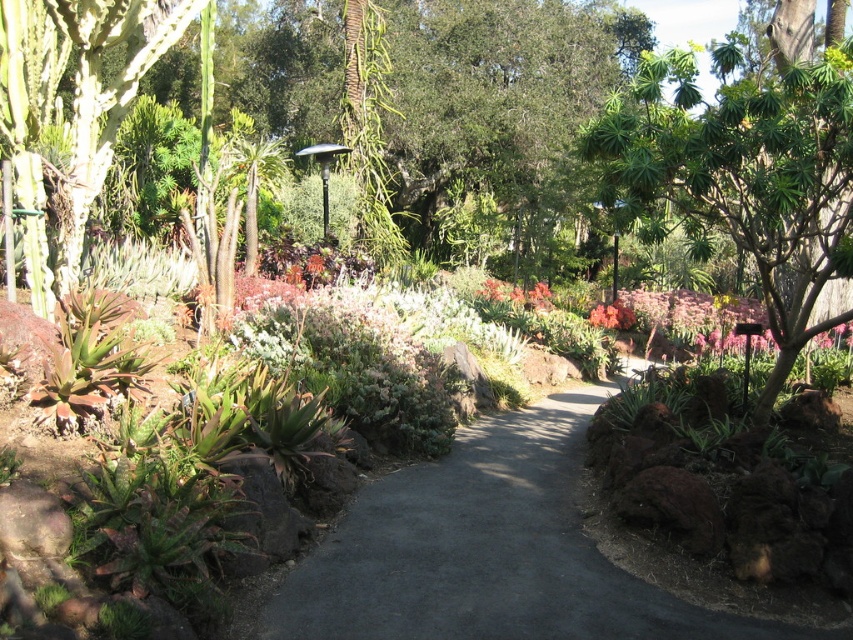
Question: Is dark gray asphalt at center thinner than green spiky cactus at left?

Choices:
 (A) no
 (B) yes

Answer: (A)

Question: Is green spiky cactus at left thinner than pink matte flower at center?

Choices:
 (A) yes
 (B) no

Answer: (A)

Question: Which of the following is the farthest from the observer?

Choices:
 (A) (624, 321)
 (B) (734, 58)

Answer: (A)

Question: Can you confirm if dark gray asphalt at center is bigger than pink matte flower at center?

Choices:
 (A) yes
 (B) no

Answer: (B)

Question: Which of the following is the closest to the observer?

Choices:
 (A) (100, 164)
 (B) (631, 317)

Answer: (A)

Question: Which of the following is the farthest from the observer?

Choices:
 (A) (616, 301)
 (B) (840, 246)
 (C) (553, 432)
 (D) (68, 51)

Answer: (A)